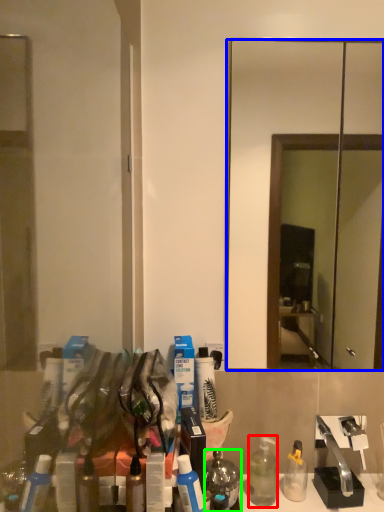
Question: Which is farther away from bottle (highlighted by a red box)? mirror (highlighted by a blue box) or mouthwash (highlighted by a green box)?

Choices:
 (A) mirror
 (B) mouthwash

Answer: (A)